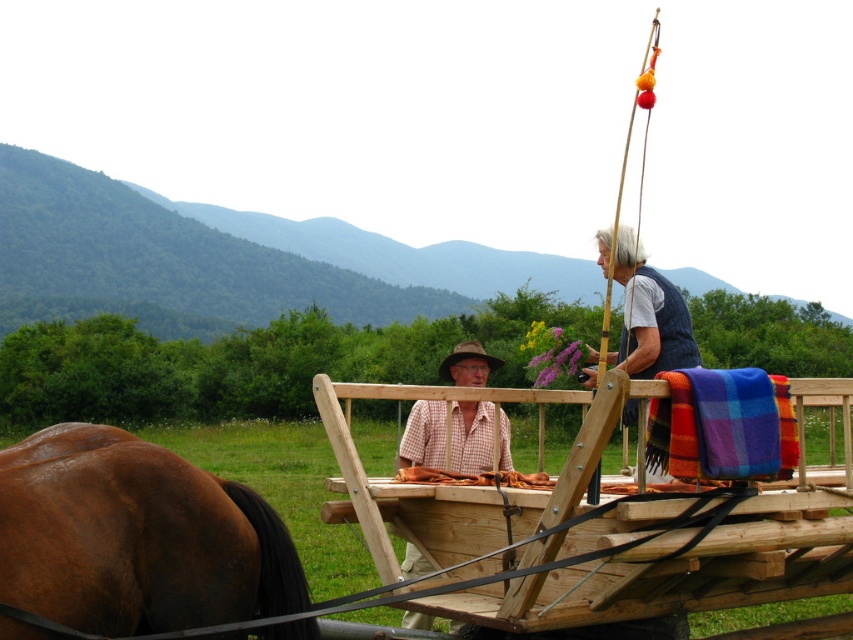
Between point (19, 492) and point (712, 472), which one is positioned in front?

Point (19, 492)

Which is above, brown glossy horse at left or plaid woolen blanket at upper right?

plaid woolen blanket at upper right is higher up.

Between point (201, 618) and point (701, 394), which one is positioned behind?

The point (201, 618) is behind.

Where is `brown glossy horse at left`? Image resolution: width=853 pixels, height=640 pixels. brown glossy horse at left is located at coordinates (136, 538).

Does wooden cart at center have a larger size compared to checkered fabric shirt at center?

Correct, wooden cart at center is larger in size than checkered fabric shirt at center.

Can you confirm if wooden cart at center is positioned above checkered fabric shirt at center?

No, wooden cart at center is not above checkered fabric shirt at center.

Where is `wooden cart at center`? The image size is (853, 640). wooden cart at center is located at coordinates [590, 528].

Can you confirm if plaid woolen blanket at upper right is thinner than checkered fabric shirt at center?

No, plaid woolen blanket at upper right is not thinner than checkered fabric shirt at center.

Between plaid woolen blanket at upper right and checkered fabric shirt at center, which one appears on the left side from the viewer's perspective?

Positioned to the left is checkered fabric shirt at center.

Locate an element on the screen. The width and height of the screenshot is (853, 640). plaid woolen blanket at upper right is located at coordinates (722, 426).